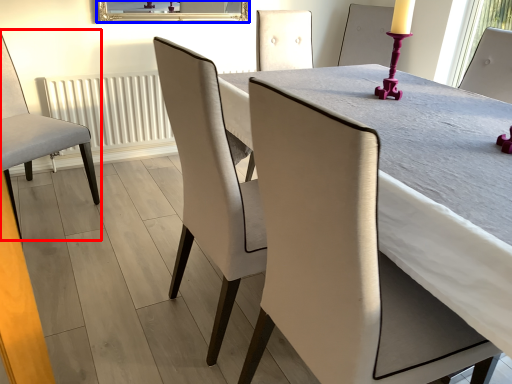
Question: Which of the following is the closest to the observer, chair (highlighted by a red box) or mirror (highlighted by a blue box)?

Choices:
 (A) chair
 (B) mirror

Answer: (A)